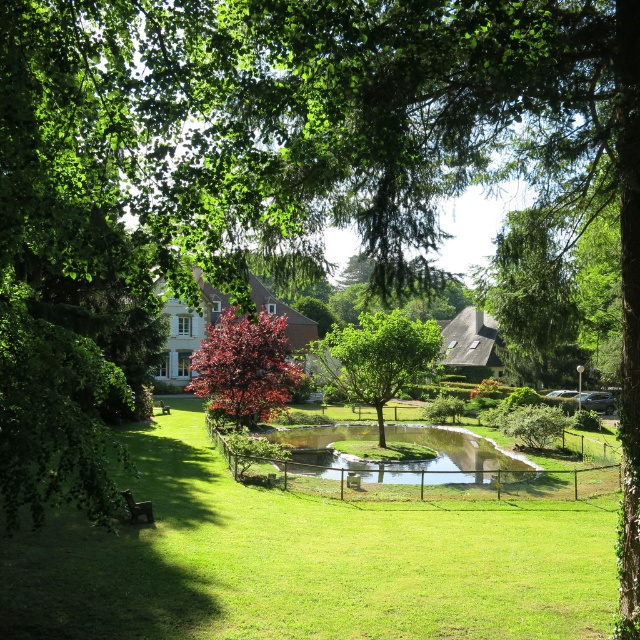
Between green grass at center and shiny red tree at center, which one is positioned higher?

shiny red tree at center

Does green grass at center have a greater height compared to shiny red tree at center?

No.

Which is behind, point (83, 573) or point (289, 374)?

Positioned behind is point (289, 374).

What are the coordinates of `green grass at center` in the screenshot? It's located at (305, 561).

This screenshot has height=640, width=640. Identify the location of shiny red tree at center. pos(244,365).

Describe the element at coordinates (244, 365) in the screenshot. I see `shiny red tree at center` at that location.

Where is `shiny red tree at center`? Image resolution: width=640 pixels, height=640 pixels. shiny red tree at center is located at coordinates (244, 365).

Does green grass at center have a lesser width compared to wooden park bench at center?

No.

Does green grass at center appear under wooden park bench at center?

Yes, green grass at center is below wooden park bench at center.

Find the location of a particular element. Image resolution: width=640 pixels, height=640 pixels. green grass at center is located at coordinates (305, 561).

Locate an element on the screen. This screenshot has height=640, width=640. green grass at center is located at coordinates (305, 561).